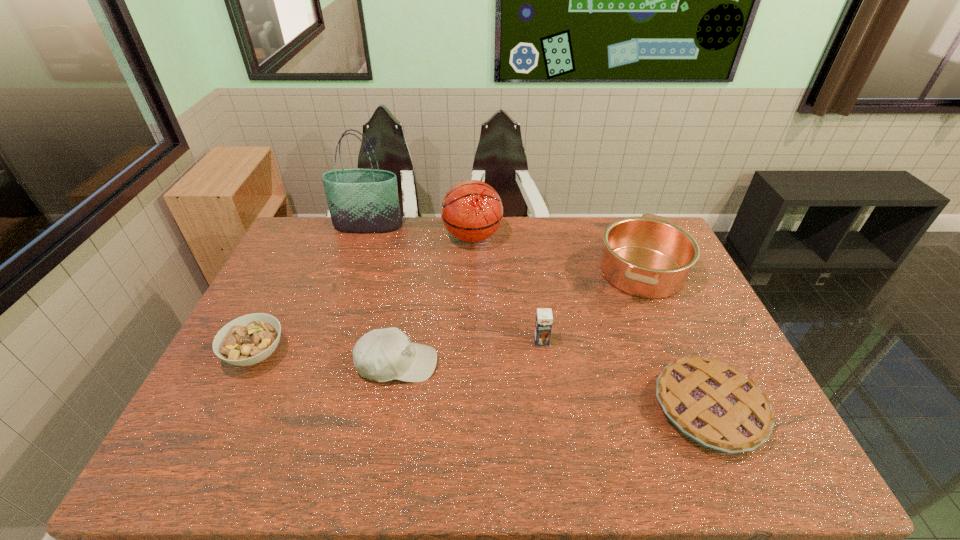
You are a GUI agent. You are given a task and a screenshot of the screen. Output one action in this format:
    pyautogui.click(x=<x>, y=<y>)
    Task: Click on the tallest object
    This screenshot has height=540, width=960.
    Given the screenshot: What is the action you would take?
    pyautogui.click(x=360, y=200)

Identify the location of the sixth shortest object. This screenshot has width=960, height=540. (472, 211).

This screenshot has height=540, width=960. I want to click on saucepan, so click(x=649, y=257).

The height and width of the screenshot is (540, 960). In order to click on the third object from right to left in this screenshot , I will do `click(543, 325)`.

The image size is (960, 540). In order to click on baseball cap in this screenshot , I will do `click(382, 355)`.

I want to click on stew, so click(x=247, y=340).

Image resolution: width=960 pixels, height=540 pixels. What are the coordinates of `pie` in the screenshot? It's located at (715, 405).

This screenshot has height=540, width=960. I want to click on vacant space located on the right of the tote bag, so 483,226.

Identify the location of vacant space situated 0.390m on the side with spill of the basketball. (610, 237).

At what (x,y) coordinates should I click in order to perform the action: click on blank area located on the left of the saucepan. Please return your answer as a coordinate pair (x, y). Image resolution: width=960 pixels, height=540 pixels. Looking at the image, I should click on (486, 272).